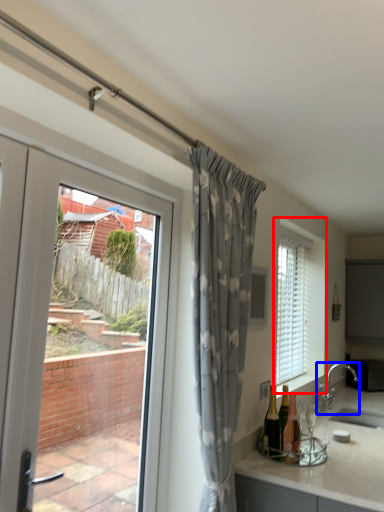
Question: Among these objects, which one is farthest to the camera, window (highlighted by a red box) or tap (highlighted by a blue box)?

Choices:
 (A) window
 (B) tap

Answer: (B)